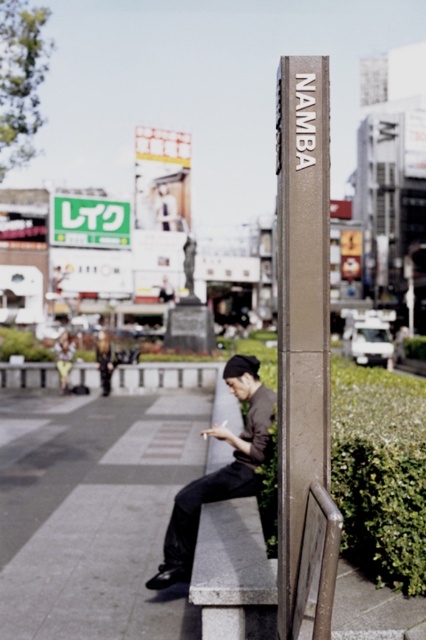
Measure the distance between gray concrete pavement at lower center and bronze metallic signpost at center.

gray concrete pavement at lower center and bronze metallic signpost at center are 4.65 meters apart from each other.

Does gray concrete pavement at lower center appear on the left side of bronze metallic signpost at center?

Yes, gray concrete pavement at lower center is to the left of bronze metallic signpost at center.

This screenshot has height=640, width=426. I want to click on gray concrete pavement at lower center, so click(94, 513).

Can you confirm if gray concrete pavement at lower center is positioned to the right of green plastic sign at upper center?

Correct, you'll find gray concrete pavement at lower center to the right of green plastic sign at upper center.

Does gray concrete pavement at lower center have a lesser width compared to green plastic sign at upper center?

In fact, gray concrete pavement at lower center might be wider than green plastic sign at upper center.

Between point (178, 456) and point (95, 214), which one is positioned in front?

Point (178, 456) is more forward.

Identify the location of gray concrete pavement at lower center. (94, 513).

Is bronze metallic signpost at center bigger than dark gray fabric jacket at center?

Incorrect, bronze metallic signpost at center is not larger than dark gray fabric jacket at center.

Does bronze metallic signpost at center appear on the left side of dark gray fabric jacket at center?

In fact, bronze metallic signpost at center is to the right of dark gray fabric jacket at center.

What do you see at coordinates (301, 304) in the screenshot? I see `bronze metallic signpost at center` at bounding box center [301, 304].

This screenshot has height=640, width=426. In order to click on bronze metallic signpost at center in this screenshot , I will do `click(301, 304)`.